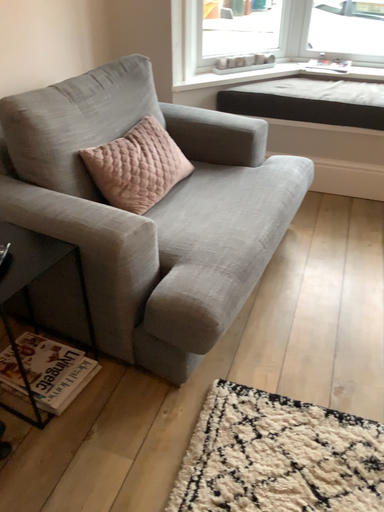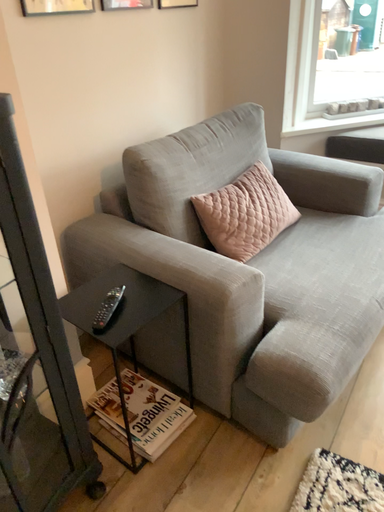
Question: How did the camera likely rotate when shooting the video?

Choices:
 (A) rotated left
 (B) rotated right

Answer: (A)